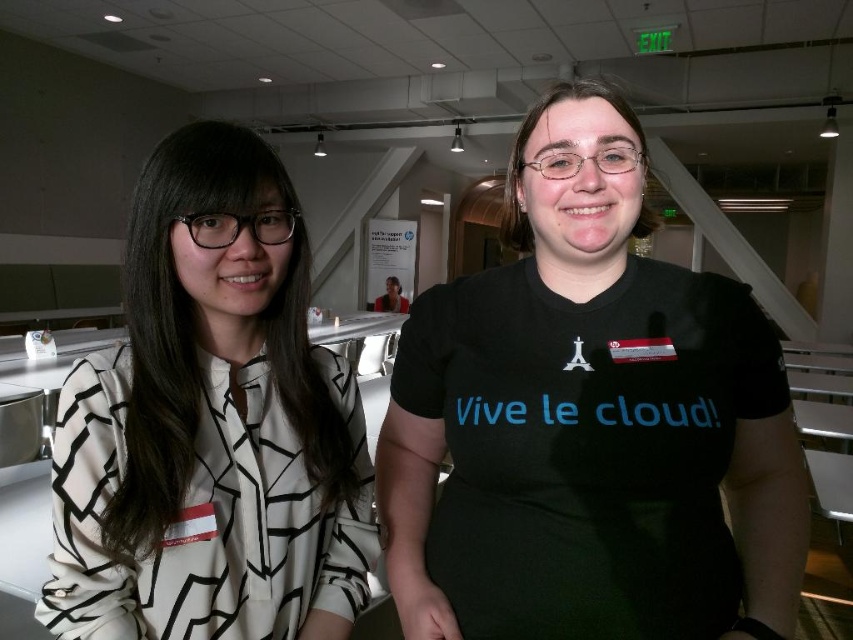
Question: Which point is closer to the camera taking this photo?

Choices:
 (A) coord(316,502)
 (B) coord(480,445)

Answer: (B)

Question: Is black matte t-shirt at center thinner than white printed blouse at left?

Choices:
 (A) no
 (B) yes

Answer: (A)

Question: Which point is farther to the camera?

Choices:
 (A) white printed blouse at left
 (B) black matte t-shirt at center

Answer: (B)

Question: Is black matte t-shirt at center further to the viewer compared to white printed blouse at left?

Choices:
 (A) no
 (B) yes

Answer: (B)

Question: Can you confirm if black matte t-shirt at center is positioned below white printed blouse at left?

Choices:
 (A) yes
 (B) no

Answer: (B)